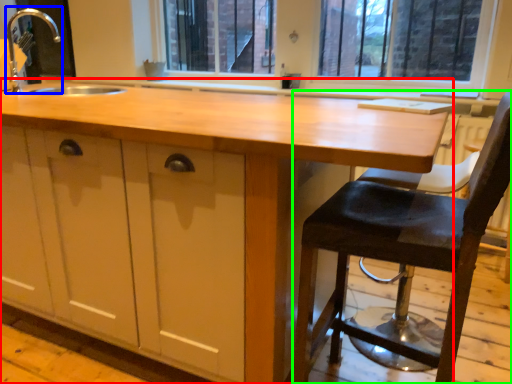
Question: Estimate the real-world distances between objects in this image. Which object is farther from countertop (highlighted by a red box), faucet (highlighted by a blue box) or chair (highlighted by a green box)?

Choices:
 (A) faucet
 (B) chair

Answer: (A)